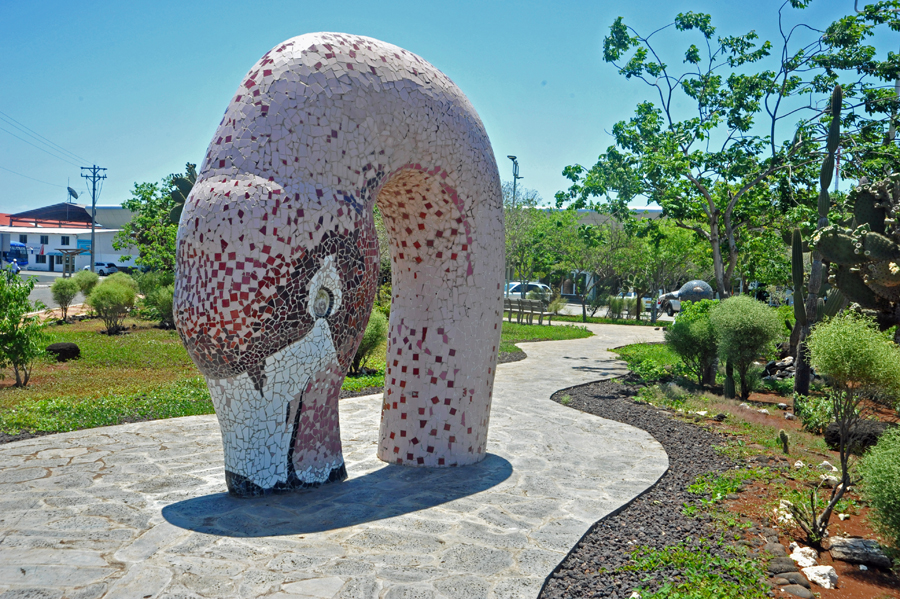
Locate an element on the screen. This screenshot has height=599, width=900. black tiles is located at coordinates (231, 487), (245, 489), (289, 481), (340, 471).